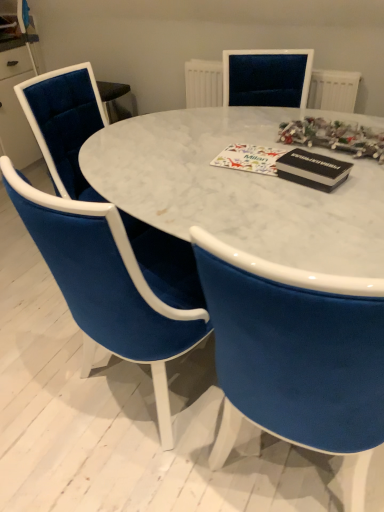
Question: Does white marble table at center have a greater width compared to black matte magazine at upper right?

Choices:
 (A) yes
 (B) no

Answer: (A)

Question: From the image's perspective, would you say white marble table at center is shown under black matte magazine at upper right?

Choices:
 (A) yes
 (B) no

Answer: (A)

Question: Can we say white marble table at center lies outside black matte magazine at upper right?

Choices:
 (A) yes
 (B) no

Answer: (A)

Question: From a real-world perspective, does white marble table at center sit lower than black matte magazine at upper right?

Choices:
 (A) yes
 (B) no

Answer: (A)

Question: From a real-world perspective, is white marble table at center on top of black matte magazine at upper right?

Choices:
 (A) yes
 (B) no

Answer: (B)

Question: In terms of width, does black matte magazine at upper right look wider or thinner when compared to white marble table at center?

Choices:
 (A) thin
 (B) wide

Answer: (A)

Question: Which is correct: black matte magazine at upper right is inside white marble table at center, or outside of it?

Choices:
 (A) inside
 (B) outside

Answer: (B)

Question: In terms of size, does black matte magazine at upper right appear bigger or smaller than white marble table at center?

Choices:
 (A) big
 (B) small

Answer: (B)

Question: From a real-world perspective, is black matte magazine at upper right physically located above or below white marble table at center?

Choices:
 (A) below
 (B) above

Answer: (B)

Question: From the image's perspective, is white marble table at center positioned above or below velvet blue chair at lower left, marked as the second chair in a front-to-back arrangement?

Choices:
 (A) above
 (B) below

Answer: (B)

Question: Is white marble table at center wider or thinner than velvet blue chair at lower left, positioned as the 1th chair in back-to-front order?

Choices:
 (A) thin
 (B) wide

Answer: (B)

Question: Considering the positions of point (372, 236) and point (36, 87), is point (372, 236) closer or farther from the camera than point (36, 87)?

Choices:
 (A) farther
 (B) closer

Answer: (B)

Question: From a real-world perspective, is white marble table at center positioned above or below velvet blue chair at lower left, marked as the second chair in a front-to-back arrangement?

Choices:
 (A) below
 (B) above

Answer: (A)

Question: In terms of size, does velvet blue chair at lower left, marked as the second chair in a front-to-back arrangement, appear bigger or smaller than white textured radiator at upper center?

Choices:
 (A) small
 (B) big

Answer: (B)

Question: Which is correct: velvet blue chair at lower left, marked as the second chair in a front-to-back arrangement, is inside white textured radiator at upper center, or outside of it?

Choices:
 (A) outside
 (B) inside

Answer: (A)